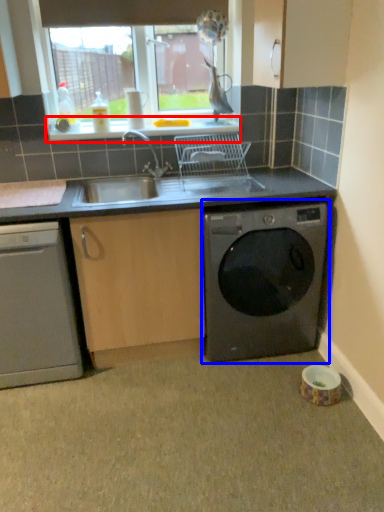
Question: Which object appears farthest to the camera in this image, window sill (highlighted by a red box) or washing machine (highlighted by a blue box)?

Choices:
 (A) window sill
 (B) washing machine

Answer: (A)